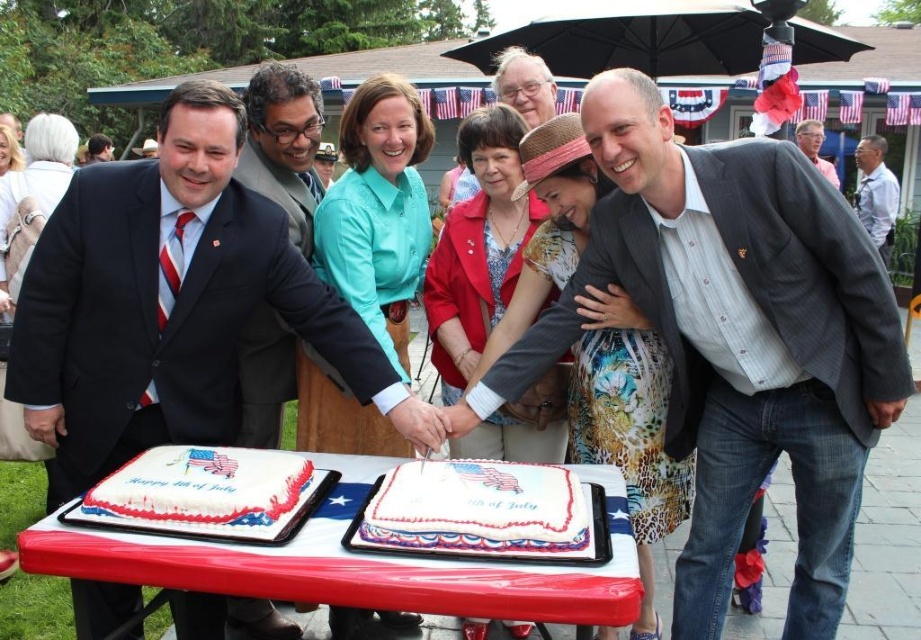
You are at a 4th of July celebration and see two men wearing black suits. One is wearing a matte black suit at left and the other a shiny black suit at center. From your perspective, which one is positioned to the left?

The matte black suit at left is positioned to the left of the shiny black suit at center, so the matte black suit at left is the one on the left side.

What are the coordinates of the matte black suit at left in the image?

The coordinates of the matte black suit at left are at point (172, 301).

You are a photographer standing at the edge of the group. You want to take a photo that includes both the shiny black suit at center and the gray shirt at upper right. Given that your camera has a maximum focus range of 10 meters, can you capture both subjects in focus without moving?

The distance between the shiny black suit at center and the gray shirt at upper right is 9.86 meters, which is within the camera maximum focus range of 10 meters. Therefore, you can capture both subjects in focus without moving.